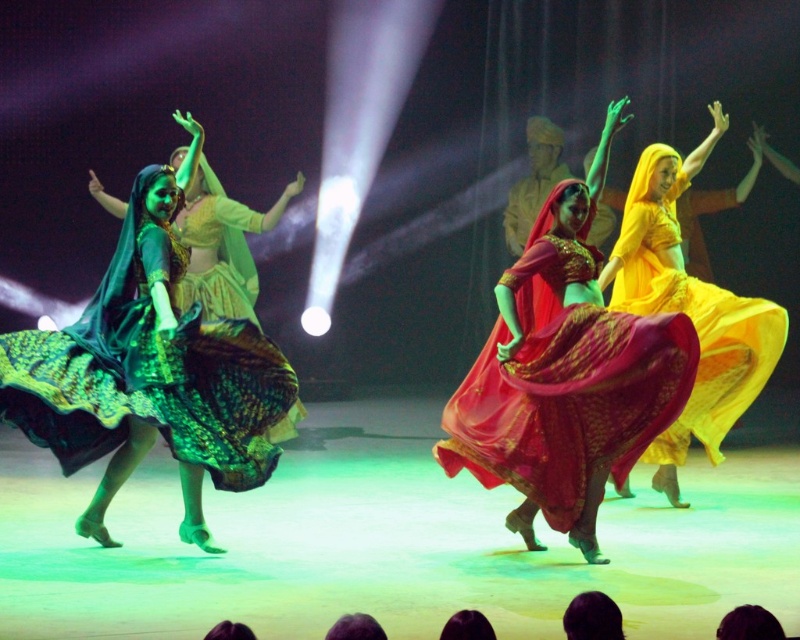
You are a photographer at the back of the theater trying to capture the dancers. You notice the matte red dress at center and the green satin dress at left. Which dress is positioned higher in the image?

The matte red dress at center is located above the green satin dress at left, so it is positioned higher in the image.

You are a photographer taking a photo of the dancers. You want to ensure both the green satin dress at left and the matte yellow dress at right are clearly visible. Which dress should you focus on to capture both in sharp detail, considering their sizes?

The green satin dress at left is smaller than the matte yellow dress at right. To capture both in sharp detail, focus on the green satin dress at left since it is closer to the camera, ensuring the matte yellow dress at right also stays in focus.

You are standing at point A located at point (684, 340). You want to walk to point B, which is 4.97 meters away from you. Is there enough space to walk straight to point B without any obstacles?

Yes, there is enough space to walk straight to point B without any obstacles because the scene describes a vibrant dance performance on stage with no mention of obstacles between the points.